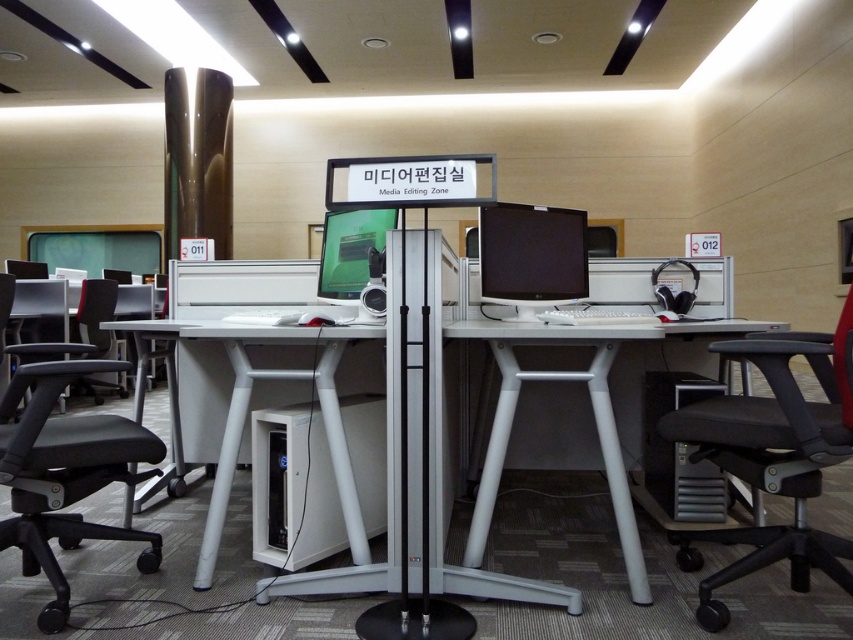
Question: Which point is closer to the camera?

Choices:
 (A) black fabric office chair at right
 (B) black leather swivel chair at lower left
 (C) matte black monitor at center
 (D) white plastic table at center

Answer: (A)

Question: Can you confirm if black fabric office chair at right is positioned below black leather swivel chair at lower left?

Choices:
 (A) no
 (B) yes

Answer: (A)

Question: Which object appears farthest from the camera in this image?

Choices:
 (A) black fabric chair at lower left
 (B) green glossy monitor at center
 (C) matte black monitor at center

Answer: (A)

Question: Which point is closer to the camera?

Choices:
 (A) (752, 321)
 (B) (44, 566)
 (C) (808, 435)

Answer: (C)

Question: Can you confirm if black fabric office chair at right is positioned above matte black monitor at center?

Choices:
 (A) yes
 (B) no

Answer: (B)

Question: Can you confirm if black fabric office chair at right is wider than white plastic table at center?

Choices:
 (A) no
 (B) yes

Answer: (A)